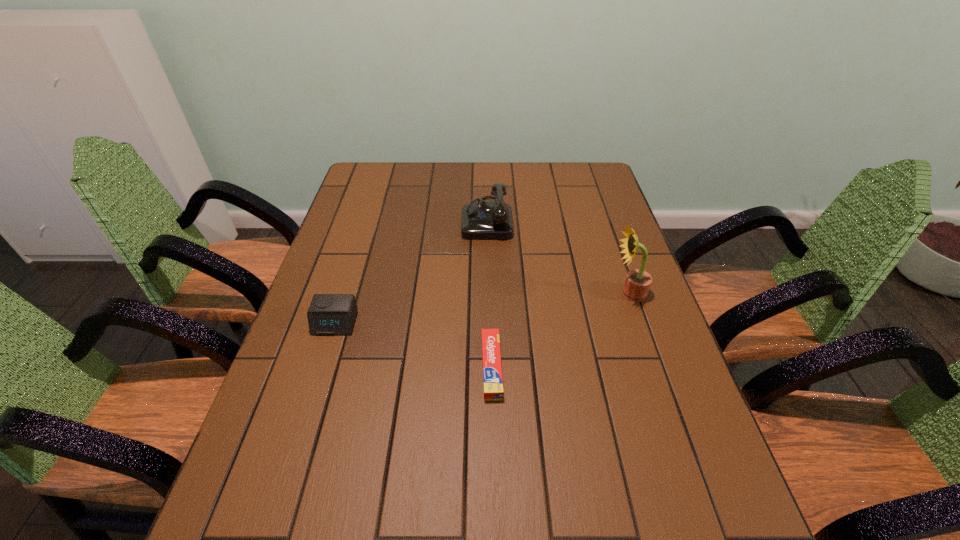
Where is `free spot between the nearest object and the tallest object`? The height and width of the screenshot is (540, 960). free spot between the nearest object and the tallest object is located at coordinates (561, 330).

Locate an element on the screen. This screenshot has height=540, width=960. vacant point located between the third farthest object and the nearest object is located at coordinates tap(414, 345).

Identify which object is located as the third nearest to the second farthest object. Please provide its 2D coordinates. Your answer should be formatted as a tuple, i.e. [(x, y)], where the tuple contains the x and y coordinates of a point satisfying the conditions above.

[(329, 314)]

In order to click on object that ranks as the third closest to the leftmost object in this screenshot , I will do `click(637, 283)`.

Identify the location of vacant space that satisfies the following two spatial constraints: 1. on the dial of the farthest object; 2. on the front-facing side of the third farthest object. Image resolution: width=960 pixels, height=540 pixels. (489, 323).

At what (x,y) coordinates should I click in order to perform the action: click on vacant region that satisfies the following two spatial constraints: 1. on the front-facing side of the shortest object; 2. on the left side of the alarm clock. Please return your answer as a coordinate pair (x, y). Looking at the image, I should click on (322, 367).

This screenshot has width=960, height=540. I want to click on free spot that satisfies the following two spatial constraints: 1. on the dial of the telephone; 2. on the front-facing side of the third tallest object, so click(x=489, y=323).

I want to click on free space that satisfies the following two spatial constraints: 1. on the front-facing side of the toothpaste; 2. on the left side of the second shortest object, so click(322, 367).

You are a GUI agent. You are given a task and a screenshot of the screen. Output one action in this format:
    pyautogui.click(x=<x>, y=<y>)
    Task: Click on the vacant space that satisfies the following two spatial constraints: 1. on the dial of the farthest object; 2. on the front-facing side of the alarm clock
    The height and width of the screenshot is (540, 960).
    Given the screenshot: What is the action you would take?
    pyautogui.click(x=489, y=323)